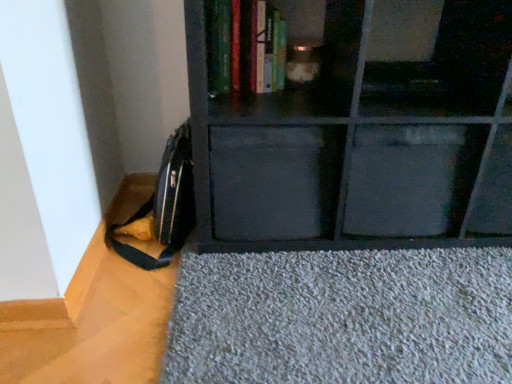
Question: Would you say metallic gray drawer at center, which is the second drawer in left-to-right order, is outside matte black shelf at center?

Choices:
 (A) no
 (B) yes

Answer: (A)

Question: Does metallic gray drawer at center, which is the second drawer in left-to-right order, have a greater height compared to matte black shelf at center?

Choices:
 (A) no
 (B) yes

Answer: (A)

Question: From the image's perspective, is metallic gray drawer at center, which is the second drawer in left-to-right order, over matte black shelf at center?

Choices:
 (A) yes
 (B) no

Answer: (B)

Question: Is metallic gray drawer at center, arranged as the first drawer when viewed from the right, surrounding matte black shelf at center?

Choices:
 (A) yes
 (B) no

Answer: (B)

Question: Is the depth of metallic gray drawer at center, which is the second drawer in left-to-right order, less than that of matte black shelf at center?

Choices:
 (A) no
 (B) yes

Answer: (A)

Question: Can you confirm if metallic gray drawer at center, which is the second drawer in left-to-right order, is bigger than matte black shelf at center?

Choices:
 (A) yes
 (B) no

Answer: (B)

Question: Can you confirm if metallic gray drawer at center, which is the second drawer in left-to-right order, is shorter than hardcover book at upper center?

Choices:
 (A) yes
 (B) no

Answer: (B)

Question: Does metallic gray drawer at center, which is the second drawer in left-to-right order, have a smaller size compared to hardcover book at upper center?

Choices:
 (A) no
 (B) yes

Answer: (A)

Question: Can you confirm if metallic gray drawer at center, which is the second drawer in left-to-right order, is positioned to the right of hardcover book at upper center?

Choices:
 (A) no
 (B) yes

Answer: (B)

Question: Is metallic gray drawer at center, arranged as the first drawer when viewed from the right, taller than hardcover book at upper center?

Choices:
 (A) yes
 (B) no

Answer: (A)

Question: Can you confirm if metallic gray drawer at center, arranged as the first drawer when viewed from the right, is wider than hardcover book at upper center?

Choices:
 (A) yes
 (B) no

Answer: (A)

Question: Is metallic gray drawer at center, arranged as the first drawer when viewed from the right, not near hardcover book at upper center?

Choices:
 (A) yes
 (B) no

Answer: (B)

Question: Can you confirm if hardcover book at upper center is bigger than metallic gray drawer at center, which is the second drawer in left-to-right order?

Choices:
 (A) yes
 (B) no

Answer: (B)